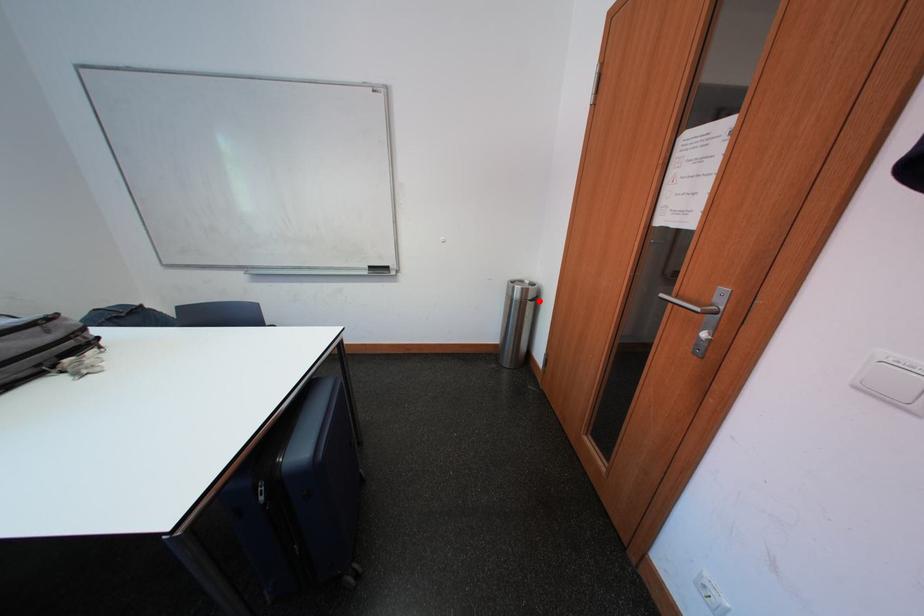
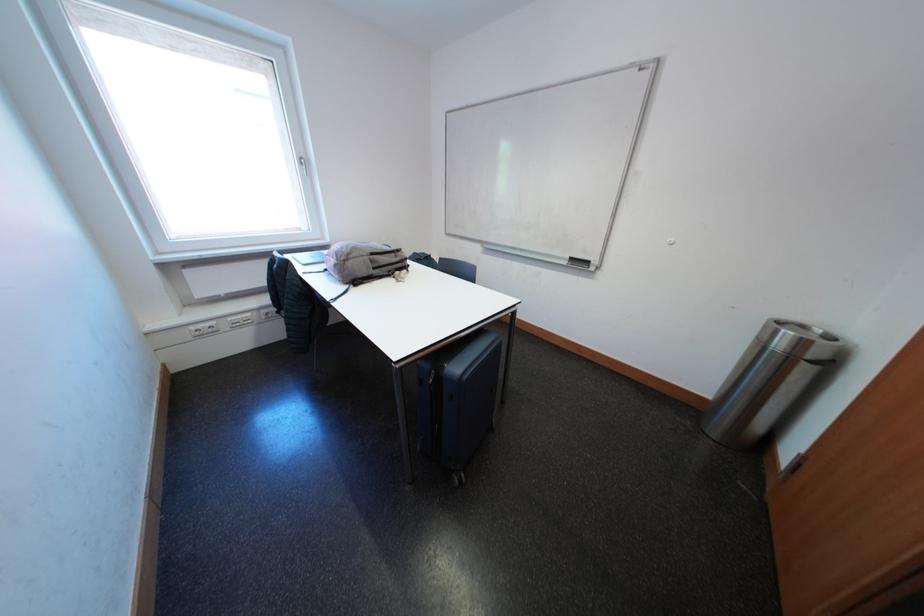
The point at the highlighted location is marked in the first image. Where is the corresponding point in the second image?

(821, 360)